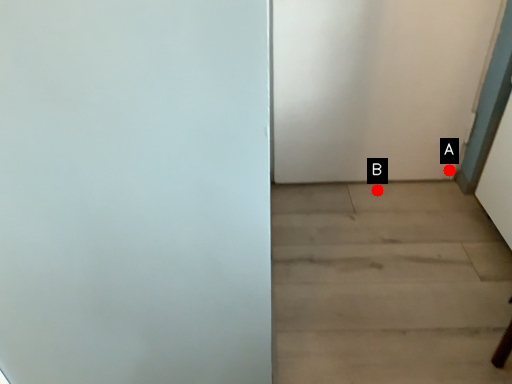
Question: Two points are circled on the image, labeled by A and B beside each circle. Which point is closer to the camera taking this photo?

Choices:
 (A) A is closer
 (B) B is closer

Answer: (A)